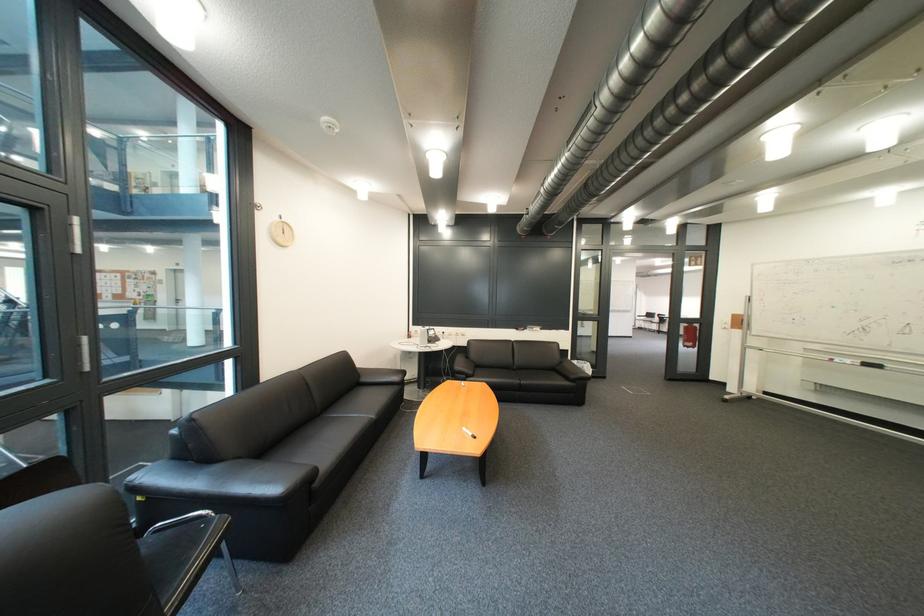
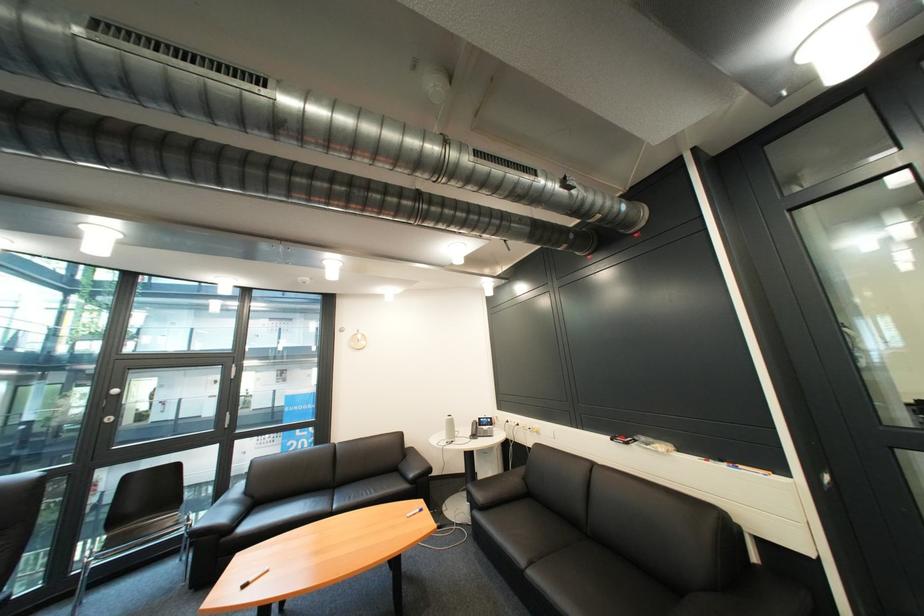
Locate, in the second image, the point that corresponds to (441,331) in the first image.

(492, 419)